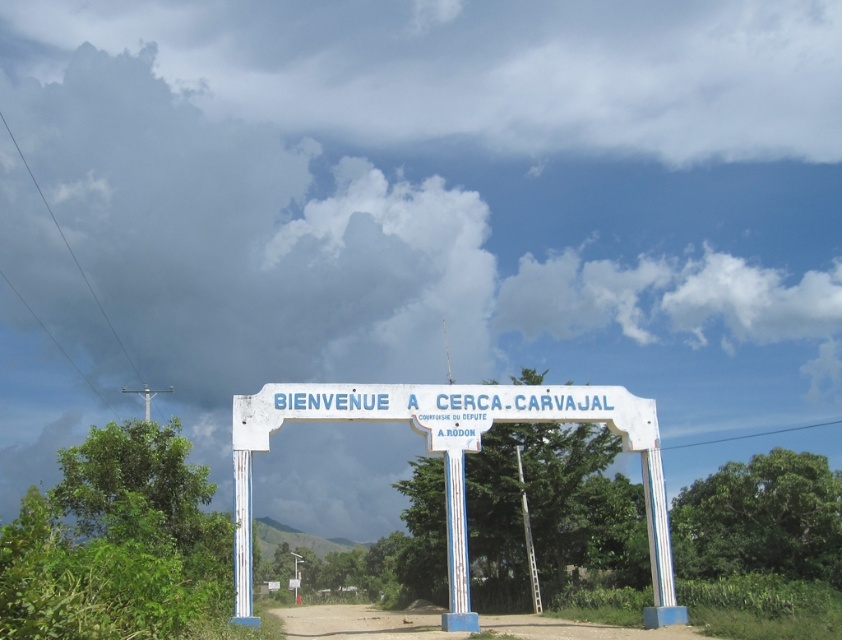
Who is positioned more to the left, white painted metal arch at center or brown dirt track at lower center?

brown dirt track at lower center is more to the left.

Between point (320, 396) and point (417, 609), which one is positioned in front?

Point (320, 396)

You are a GUI agent. You are given a task and a screenshot of the screen. Output one action in this format:
    pyautogui.click(x=<x>, y=<y>)
    Task: Click on the white painted metal arch at center
    The height and width of the screenshot is (640, 842).
    Given the screenshot: What is the action you would take?
    pyautogui.click(x=454, y=460)